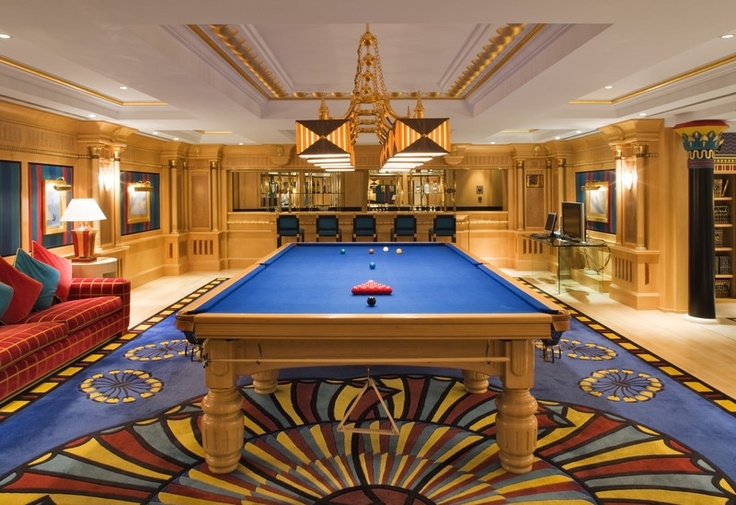
Where is `red couch`? red couch is located at coordinates (45, 339).